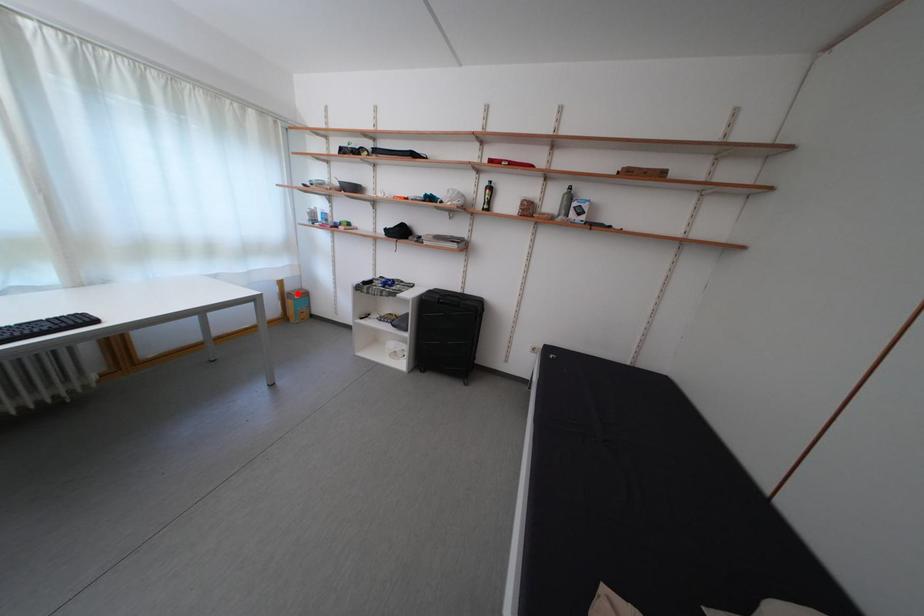
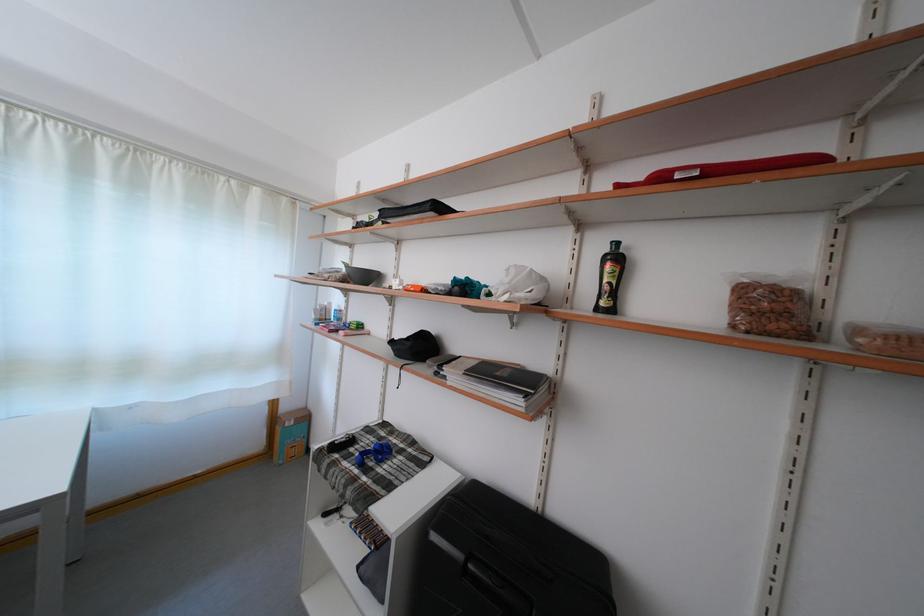
The point at the highlighted location is marked in the first image. Where is the corresponding point in the second image?

(293, 415)